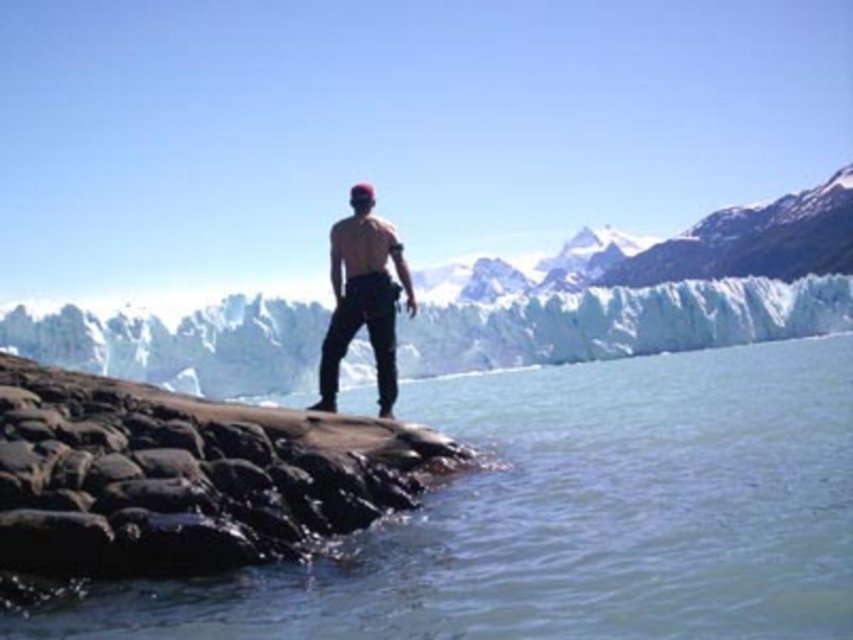
Can you confirm if snowy ice glacier at upper center is positioned below rough textured rock at center?

Incorrect, snowy ice glacier at upper center is not positioned below rough textured rock at center.

Which is in front, point (805, 236) or point (195, 433)?

Point (195, 433)

The height and width of the screenshot is (640, 853). What are the coordinates of `snowy ice glacier at upper center` in the screenshot? It's located at (646, 291).

Does snowy ice glacier at upper center appear over matte black pants at center?

Correct, snowy ice glacier at upper center is located above matte black pants at center.

Which is behind, point (625, 264) or point (378, 339)?

Point (625, 264)

Locate an element on the screen. snowy ice glacier at upper center is located at coordinates coord(646,291).

Does point (451, 612) come in front of point (397, 272)?

That is True.

Can you confirm if clear water at rock edge is positioned to the right of matte black pants at center?

Correct, you'll find clear water at rock edge to the right of matte black pants at center.

In order to click on clear water at rock edge in this screenshot , I will do `click(569, 516)`.